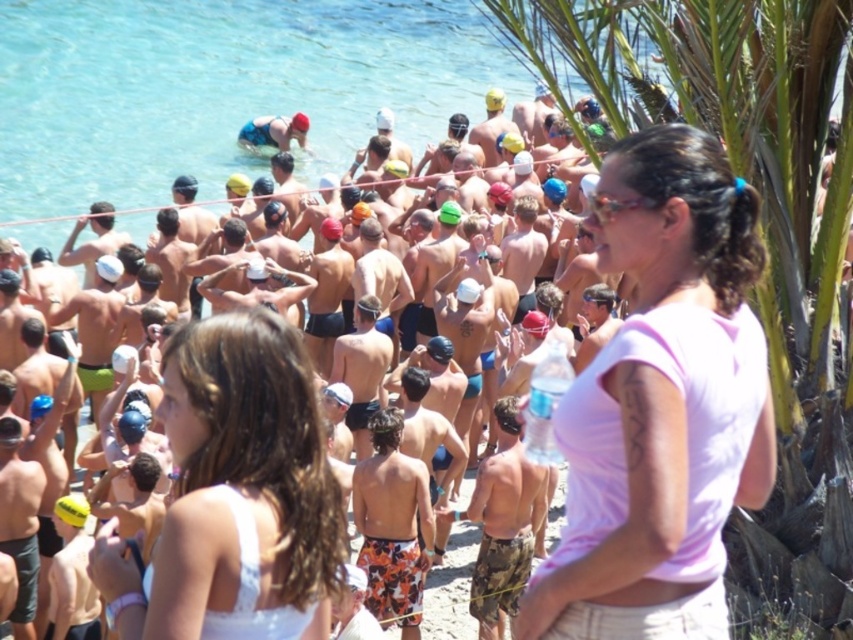
Can you confirm if pink fabric shirt at center is positioned to the left of white fabric at center?

In fact, pink fabric shirt at center is to the right of white fabric at center.

The height and width of the screenshot is (640, 853). What do you see at coordinates (660, 404) in the screenshot?
I see `pink fabric shirt at center` at bounding box center [660, 404].

Where is `pink fabric shirt at center`? Image resolution: width=853 pixels, height=640 pixels. pink fabric shirt at center is located at coordinates (660, 404).

Is clear blue water at center thinner than matte swim caps at center?

No.

Identify the location of clear blue water at center. The height and width of the screenshot is (640, 853). coord(222,90).

The image size is (853, 640). What are the coordinates of `clear blue water at center` in the screenshot? It's located at [x=222, y=90].

Does clear blue water at center have a greater width compared to white fabric at center?

Yes, clear blue water at center is wider than white fabric at center.

Find the location of a particular element. clear blue water at center is located at coordinates (x=222, y=90).

Locate an element on the screen. clear blue water at center is located at coordinates (222, 90).

You are a GUI agent. You are given a task and a screenshot of the screen. Output one action in this format:
    pyautogui.click(x=<x>, y=<y>)
    Task: Click on the clear blue water at center
    This screenshot has height=640, width=853.
    Given the screenshot: What is the action you would take?
    pyautogui.click(x=222, y=90)